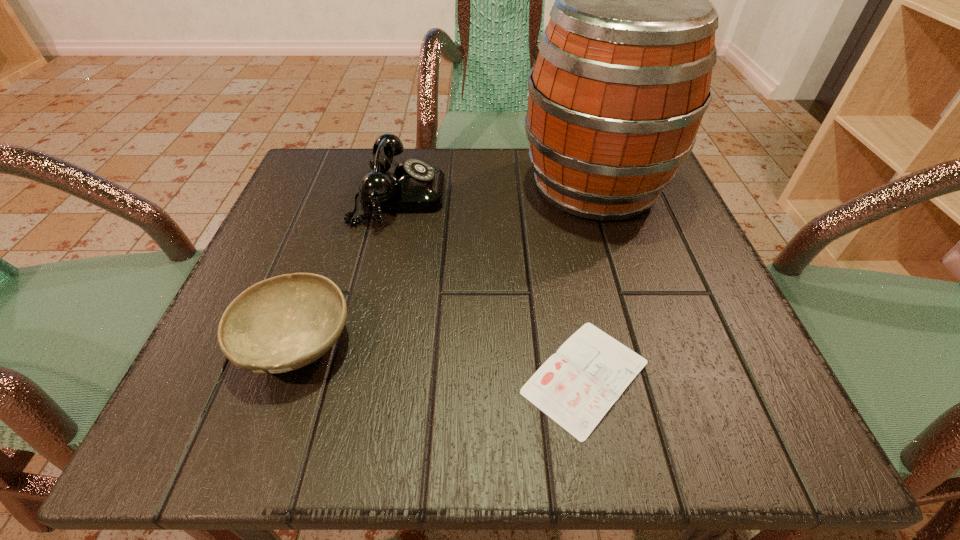
What are the coordinates of `free space between the tallest object and the telephone` in the screenshot? It's located at (496, 192).

Locate an element on the screen. The width and height of the screenshot is (960, 540). free area in between the cider and the shortest object is located at coordinates (590, 281).

Find the location of a particular element. The width and height of the screenshot is (960, 540). vacant space in between the third shortest object and the shortest object is located at coordinates (492, 287).

Image resolution: width=960 pixels, height=540 pixels. I want to click on vacant space in between the cider and the third tallest object, so click(445, 264).

You are a GUI agent. You are given a task and a screenshot of the screen. Output one action in this format:
    pyautogui.click(x=<x>, y=<y>)
    Task: Click on the free area in between the second tallest object and the tallest object
    
    Given the screenshot: What is the action you would take?
    pos(496,192)

Locate which object is the second closest to the second shortest object. Please provide its 2D coordinates. Your answer should be formatted as a tuple, i.e. [(x, y)], where the tuple contains the x and y coordinates of a point satisfying the conditions above.

[(576, 387)]

Identify the location of the second closest object to the tallest object. (576, 387).

Identify the location of free spot that satisfies the following two spatial constraints: 1. on the dial of the diary; 2. on the left side of the third shortest object. (360, 376).

The height and width of the screenshot is (540, 960). Find the location of `free space that satisfies the following two spatial constraints: 1. on the dial of the diary; 2. on the right side of the second tallest object`. free space that satisfies the following two spatial constraints: 1. on the dial of the diary; 2. on the right side of the second tallest object is located at coordinates (360, 376).

You are a GUI agent. You are given a task and a screenshot of the screen. Output one action in this format:
    pyautogui.click(x=<x>, y=<y>)
    Task: Click on the vacant space that satisfies the following two spatial constraints: 1. on the front side of the third tallest object; 2. on the left side of the diary
    The image size is (960, 540).
    Given the screenshot: What is the action you would take?
    pyautogui.click(x=284, y=376)